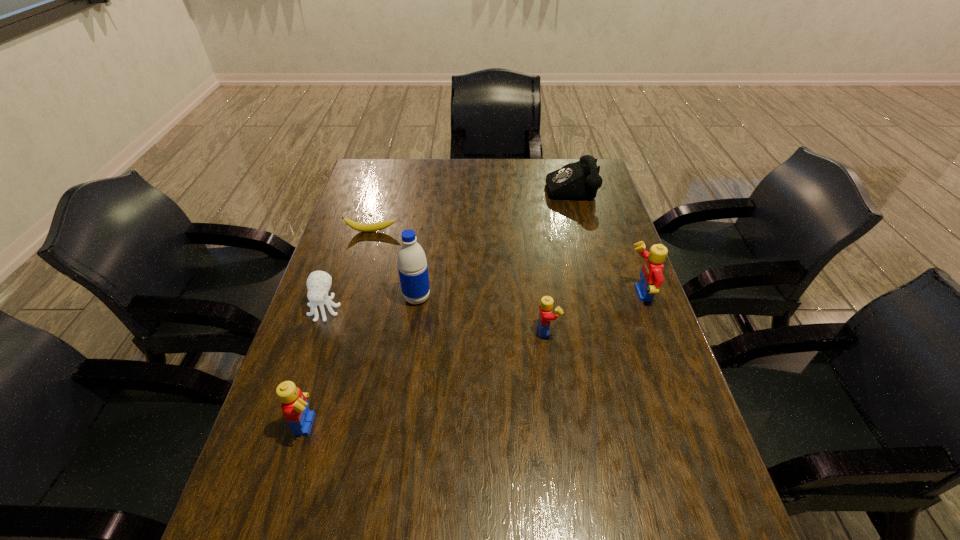
This screenshot has height=540, width=960. Identify the location of octopus. (318, 283).

Identify the location of free space located on the face of the second shortest Lego. (353, 423).

The image size is (960, 540). I want to click on blank space located 0.210m on the face of the second farthest Lego, so click(638, 330).

Where is `vacant area located 0.220m on the face of the rightmost Lego`? vacant area located 0.220m on the face of the rightmost Lego is located at coordinates (546, 295).

Where is `free space located 0.330m on the face of the rightmost Lego`? This screenshot has height=540, width=960. free space located 0.330m on the face of the rightmost Lego is located at coordinates pyautogui.click(x=507, y=295).

Find the location of a particular element. vacant space located on the face of the rightmost Lego is located at coordinates (542, 295).

What are the coordinates of `vacant space positioned on the dial of the farthest object` in the screenshot? It's located at (500, 185).

In order to click on free space located on the dial of the farthest object in this screenshot , I will do `click(530, 185)`.

Identify the location of free space located 0.320m on the dial of the farthest object. (459, 185).

Where is `vacant area situated on the upward curve of the shortest object`? The height and width of the screenshot is (540, 960). vacant area situated on the upward curve of the shortest object is located at coordinates (356, 284).